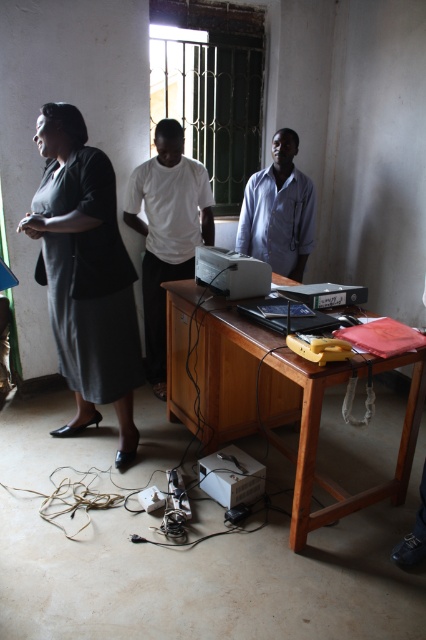
You are standing in the office and need to reach both points on the desk. Which point, point (294, 502) or point (256, 278), is closer to you?

Point (294, 502) is closer to the viewer than point (256, 278).

You are standing in the office scene described. There is a point labeled at coordinates (270, 396). What object is located at this point?

The point at coordinates (270, 396) corresponds to the wooden table at center.

You are organizing a meeting in this office and need to place a large whiteboard on the desk. Based on the wooden table at center and the white plastic printer at center, which object should you consider the width of to ensure the whiteboard fits?

You should consider the width of the wooden table at center because it might be wider than the white plastic printer at center, making it more suitable for placing the whiteboard.